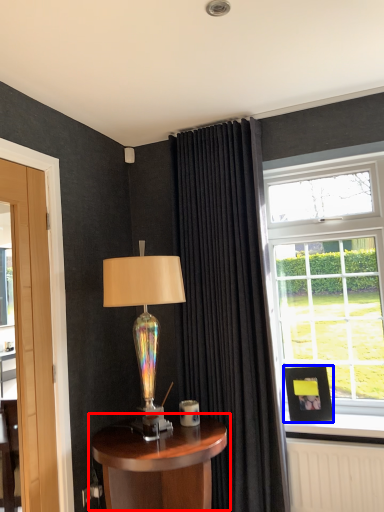
Question: Which object is further to the camera taking this photo, table (highlighted by a red box) or picture frame (highlighted by a blue box)?

Choices:
 (A) table
 (B) picture frame

Answer: (B)